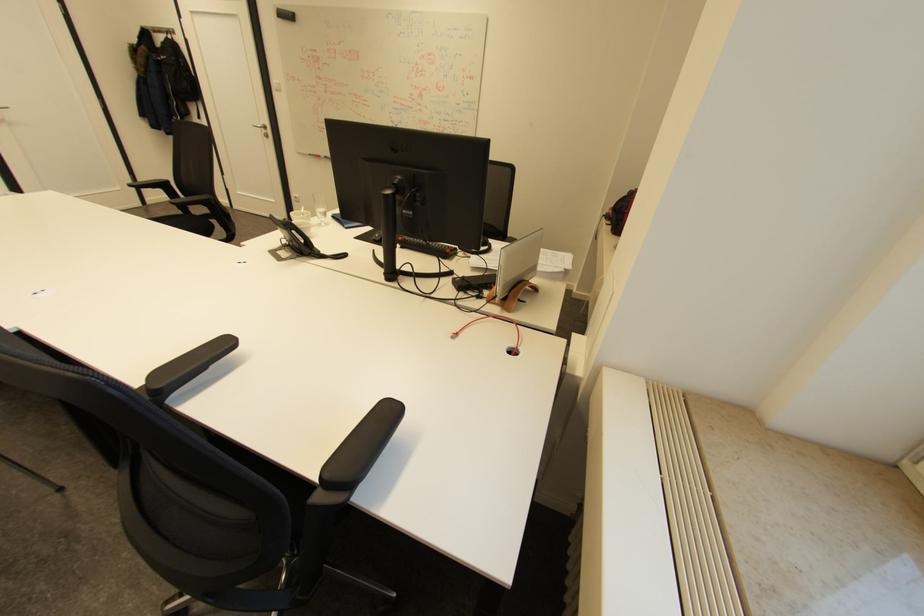
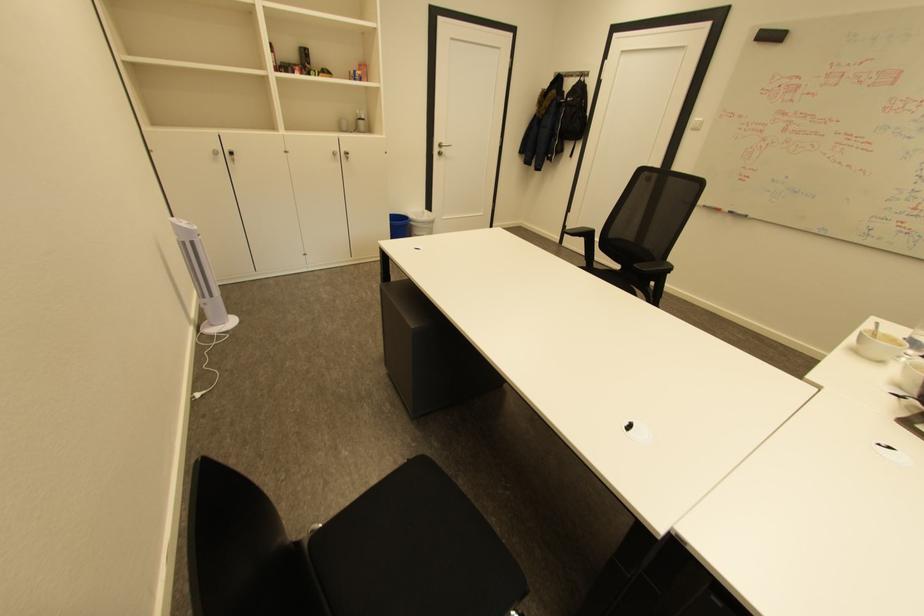
Find the pixel in the second image that matches [169,185] in the first image.

(594, 233)